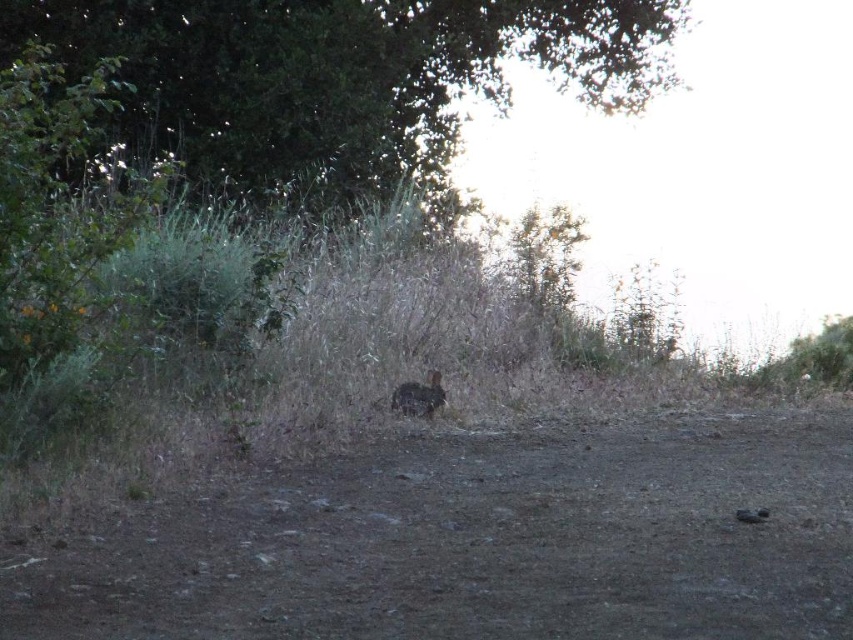
You are a photographer trying to capture the brown furry rabbit at center. You are standing on the dull brown dirt at center. To get a clear shot, should you move to your left or right?

The dull brown dirt at center is positioned on the right side of the brown furry rabbit at center. To get a clear shot, you should move to your left to avoid blocking the view with the dirt.

You are standing at the point with coordinates point (746, 616) and want to walk towards point (405, 384). Given the terrain described in the scene, will you have to climb over any obstacles along the way?

Point (746, 616) is in front of point (405, 384), so you are already ahead of the destination. Therefore, you won

Looking at this image, you are a hiker trying to navigate through the dirt path in the image. You see the dull brown dirt at center and the green leafy tree at upper center. Which object is closer to the ground?

The dull brown dirt at center is located below the green leafy tree at upper center, so the dull brown dirt at center is closer to the ground.